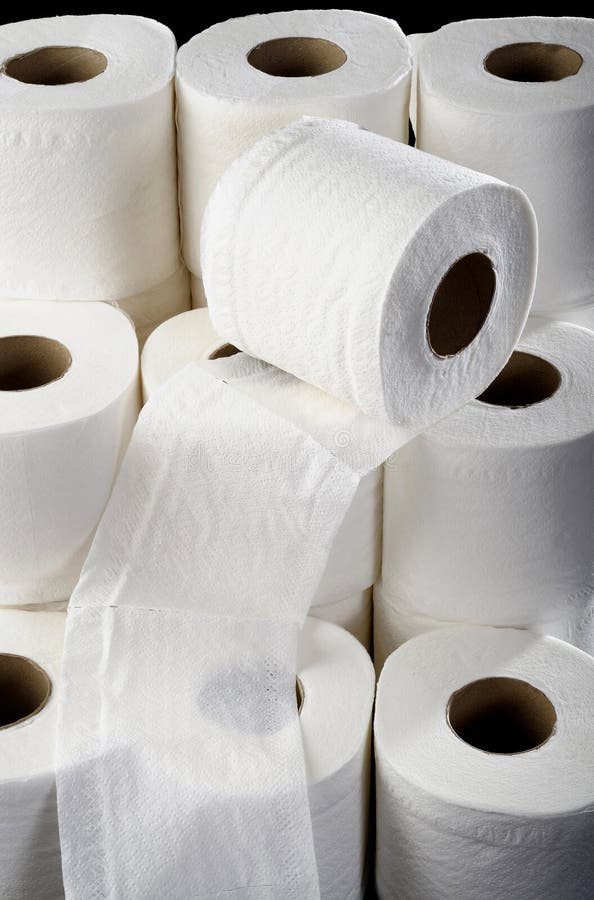
The image size is (594, 900). What are the coordinates of `toilet paper cardboard core` in the screenshot? It's located at (30, 680), (301, 695), (497, 699), (510, 383), (448, 307), (226, 347), (37, 355), (62, 60), (301, 54), (533, 58).